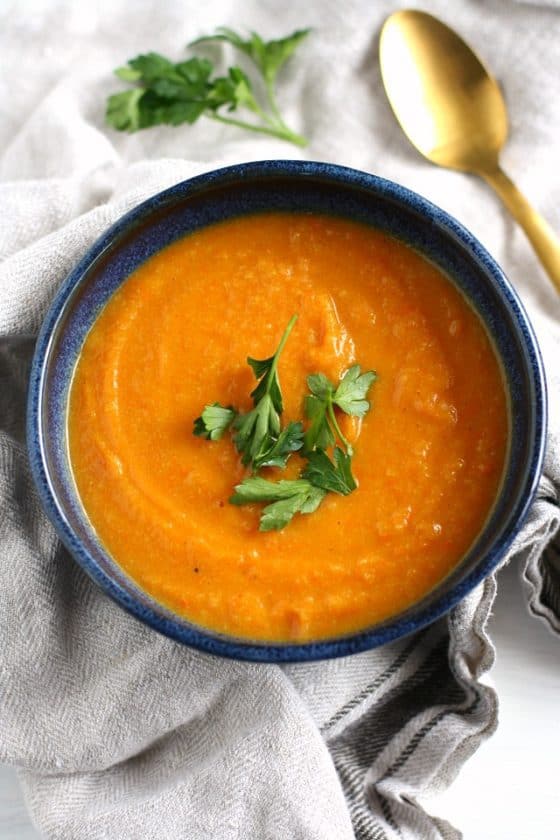
This screenshot has height=840, width=560. I want to click on dark gray stripes on towel, so click(x=339, y=714), click(x=386, y=722), click(x=415, y=743).